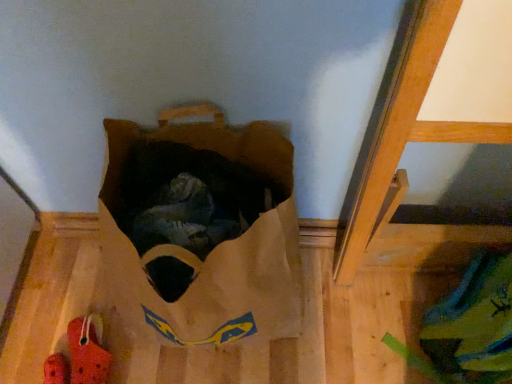
Question: Is point (150, 258) closer or farther from the camera than point (78, 324)?

Choices:
 (A) farther
 (B) closer

Answer: (B)

Question: Considering the positions of brown paper bag at upper center and rubber/crocodile at lower left in the image, is brown paper bag at upper center wider or thinner than rubber/crocodile at lower left?

Choices:
 (A) wide
 (B) thin

Answer: (A)

Question: From the image's perspective, is brown paper bag at upper center above or below rubber/crocodile at lower left?

Choices:
 (A) above
 (B) below

Answer: (A)

Question: Looking at the image, does rubber/crocodile at lower left seem bigger or smaller compared to brown paper bag at upper center?

Choices:
 (A) big
 (B) small

Answer: (B)

Question: Is point (98, 357) closer or farther from the camera than point (258, 292)?

Choices:
 (A) closer
 (B) farther

Answer: (B)

Question: In the image, is rubber/crocodile at lower left positioned in front of or behind brown paper bag at upper center?

Choices:
 (A) front
 (B) behind

Answer: (B)

Question: Is rubber/crocodile at lower left taller or shorter than brown paper bag at upper center?

Choices:
 (A) short
 (B) tall

Answer: (A)